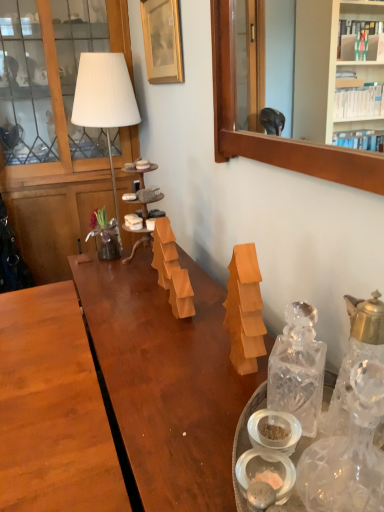
Question: Would you say clear glass carafe at right, which appears as the 1th bottle when viewed from the right, contains wooden picture frame at upper center?

Choices:
 (A) yes
 (B) no

Answer: (B)

Question: Is clear glass carafe at right, which appears as the 1th bottle when viewed from the right, to the left of wooden picture frame at upper center from the viewer's perspective?

Choices:
 (A) no
 (B) yes

Answer: (A)

Question: Considering the relative sizes of clear glass carafe at right, the 2th bottle in the left-to-right sequence, and wooden picture frame at upper center in the image provided, is clear glass carafe at right, the 2th bottle in the left-to-right sequence, shorter than wooden picture frame at upper center?

Choices:
 (A) no
 (B) yes

Answer: (B)

Question: Is clear glass carafe at right, the 2th bottle in the left-to-right sequence, touching wooden picture frame at upper center?

Choices:
 (A) yes
 (B) no

Answer: (B)

Question: Considering the relative sizes of clear glass carafe at right, the 2th bottle in the left-to-right sequence, and wooden picture frame at upper center in the image provided, is clear glass carafe at right, the 2th bottle in the left-to-right sequence, thinner than wooden picture frame at upper center?

Choices:
 (A) no
 (B) yes

Answer: (A)

Question: Considering the positions of point (344, 374) and point (165, 76), is point (344, 374) closer or farther from the camera than point (165, 76)?

Choices:
 (A) closer
 (B) farther

Answer: (A)

Question: Looking at the image, does clear glass carafe at right, which appears as the 1th bottle when viewed from the right, seem bigger or smaller compared to wooden picture frame at upper center?

Choices:
 (A) big
 (B) small

Answer: (B)

Question: Is clear glass carafe at right, which appears as the 1th bottle when viewed from the right, inside the boundaries of wooden picture frame at upper center, or outside?

Choices:
 (A) inside
 (B) outside

Answer: (B)

Question: Is clear glass carafe at right, the 2th bottle in the left-to-right sequence, taller or shorter than wooden picture frame at upper center?

Choices:
 (A) short
 (B) tall

Answer: (A)

Question: Is clear glass carafe at right, the 2th bottle in the left-to-right sequence, taller or shorter than wooden tiered tray at center?

Choices:
 (A) tall
 (B) short

Answer: (B)

Question: Considering the positions of point (342, 422) and point (137, 231), is point (342, 422) closer or farther from the camera than point (137, 231)?

Choices:
 (A) closer
 (B) farther

Answer: (A)

Question: Relative to wooden tiered tray at center, is clear glass carafe at right, the 2th bottle in the left-to-right sequence, in front or behind?

Choices:
 (A) behind
 (B) front

Answer: (B)

Question: Looking at the image, does clear glass carafe at right, the 2th bottle in the left-to-right sequence, seem bigger or smaller compared to wooden tiered tray at center?

Choices:
 (A) small
 (B) big

Answer: (A)

Question: From the image's perspective, is wooden frame at upper right above or below clear glass carafe at right, which appears as the 1th bottle when viewed from the right?

Choices:
 (A) below
 (B) above

Answer: (B)

Question: Is point (246, 48) positioned closer to the camera than point (334, 414)?

Choices:
 (A) farther
 (B) closer

Answer: (A)